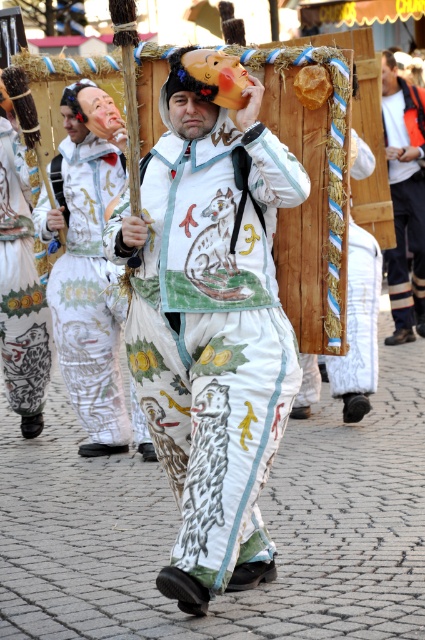
Does matte plastic mask at upper center have a greater height compared to matte brown mask at upper center?

Incorrect, matte plastic mask at upper center's height is not larger of matte brown mask at upper center's.

Who is shorter, matte plastic mask at upper center or matte brown mask at upper center?

matte plastic mask at upper center

Where is `matte plastic mask at upper center`? This screenshot has height=640, width=425. matte plastic mask at upper center is located at coordinates pyautogui.click(x=95, y=113).

This screenshot has width=425, height=640. In order to click on matte plastic mask at upper center in this screenshot , I will do click(x=95, y=113).

Who is more forward, (215, 413) or (124, 125)?

Point (215, 413) is in front.

Is point (272, 172) less distant than point (68, 131)?

Yes, point (272, 172) is closer to viewer.

The image size is (425, 640). Identify the location of white painted fabric costume at center. (210, 326).

The height and width of the screenshot is (640, 425). In order to click on white painted fabric costume at center in this screenshot , I will do `click(210, 326)`.

Is white painted fabric mask at center positioned before matte brown mask at upper center?

Yes, white painted fabric mask at center is closer to the viewer.

Where is `white painted fabric mask at center`? white painted fabric mask at center is located at coordinates (87, 268).